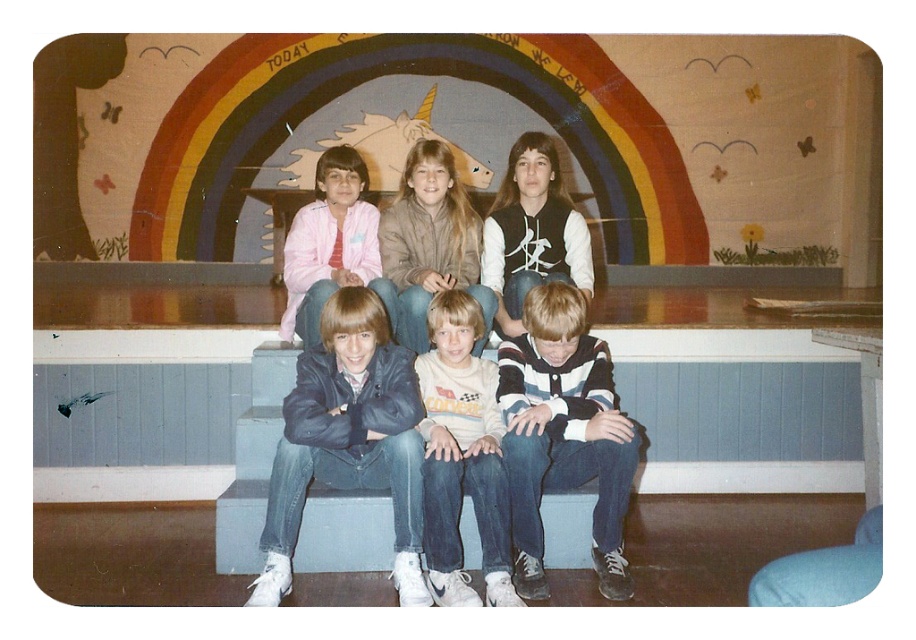
Question: Is striped cotton shirt at center to the left of white cotton shirt at center from the viewer's perspective?

Choices:
 (A) no
 (B) yes

Answer: (A)

Question: Does blue wood bench at center have a larger size compared to striped cotton shirt at center?

Choices:
 (A) yes
 (B) no

Answer: (B)

Question: Estimate the real-world distances between objects in this image. Which object is farther from the light brown suede jacket at center?

Choices:
 (A) white cotton shirt at center
 (B) pink fabric jacket at upper left

Answer: (A)

Question: Which of the following is the farthest from the observer?

Choices:
 (A) light brown suede jacket at center
 (B) denim jeans at center
 (C) white cotton shirt at center
 (D) blue wood bench at center

Answer: (D)

Question: Is dark blue leather jacket at center smaller than pink fabric jacket at upper left?

Choices:
 (A) no
 (B) yes

Answer: (B)

Question: Based on their relative distances, which object is nearer to the striped cotton shirt at center?

Choices:
 (A) white cotton shirt at center
 (B) pink fabric jacket at upper left

Answer: (A)